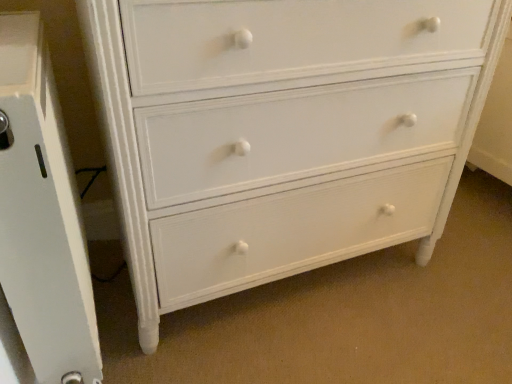
Locate an element on the screen. This screenshot has width=512, height=384. white glossy dresser at center is located at coordinates (42, 215).

The image size is (512, 384). Describe the element at coordinates (42, 215) in the screenshot. I see `white glossy dresser at center` at that location.

This screenshot has height=384, width=512. Identify the location of white glossy dresser at center. (42, 215).